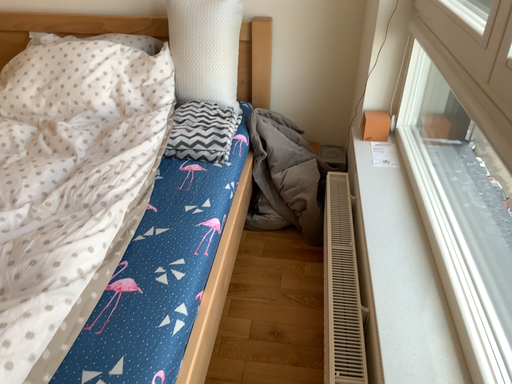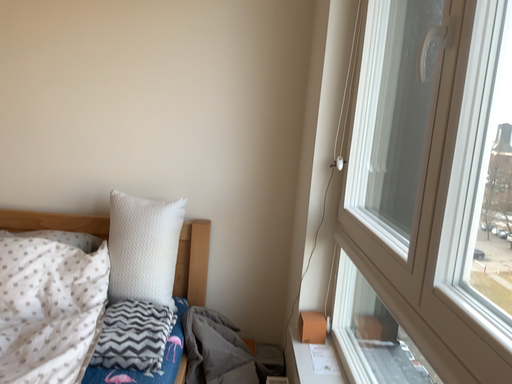
Question: Which way did the camera rotate in the video?

Choices:
 (A) rotated upward
 (B) rotated downward

Answer: (A)